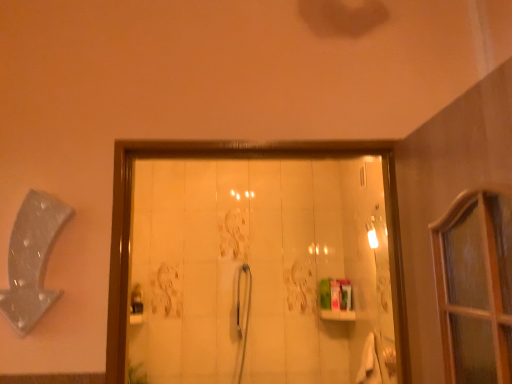
Where is `metallic silver shower handle at center`? This screenshot has height=384, width=512. metallic silver shower handle at center is located at coordinates (246, 313).

What is the approximate height of metallic silver shower handle at center?

89.45 centimeters.

The image size is (512, 384). Describe the element at coordinates (246, 313) in the screenshot. I see `metallic silver shower handle at center` at that location.

Find the location of `metallic silver shower handle at center`. metallic silver shower handle at center is located at coordinates (246, 313).